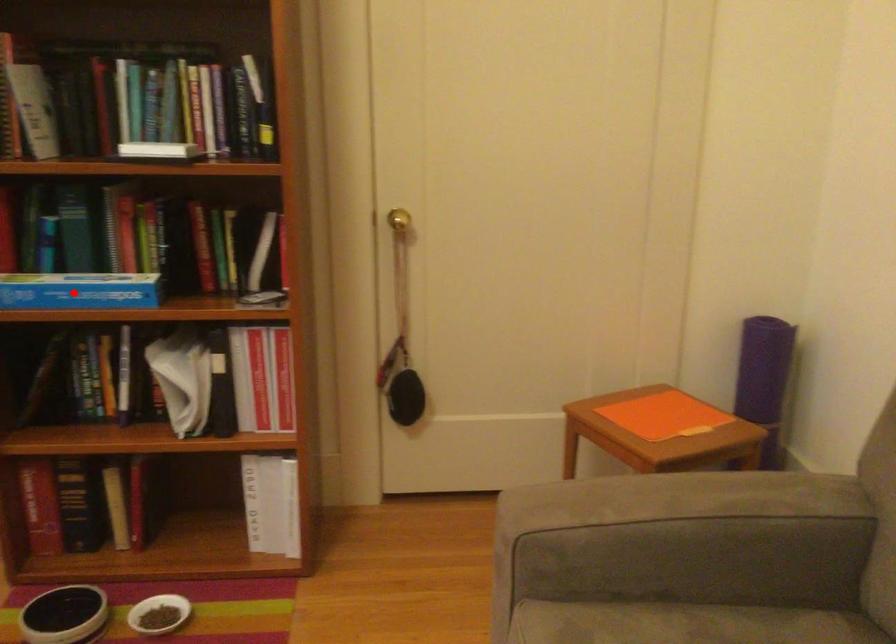
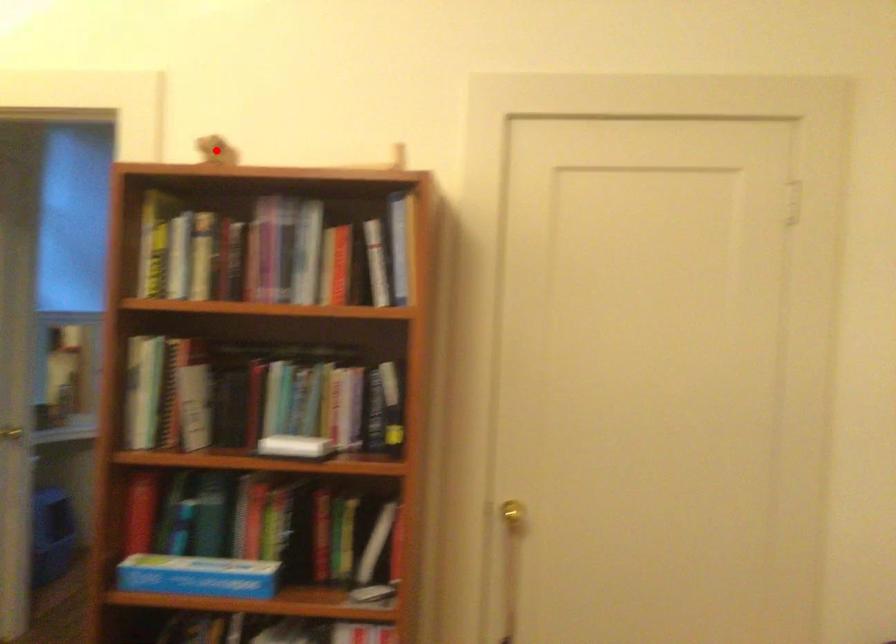
I am providing you with two images of the same scene from different viewpoints. A red point is marked on the first image and another point is marked on the second image. Are the points marked in image1 and image2 representing the same 3D position?

No